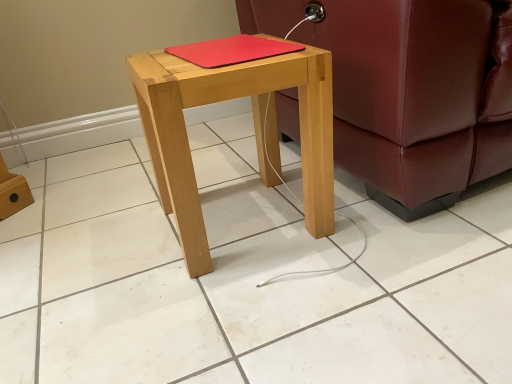
Identify the location of vacant point to the left of natural wood stool at center. Image resolution: width=512 pixels, height=384 pixels. (110, 242).